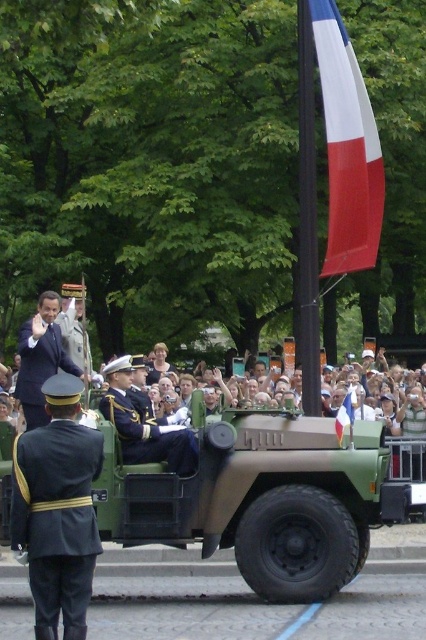
Between shiny blue fabric uniform at center and red fabric flag at center, which one has less height?

With less height is red fabric flag at center.

What do you see at coordinates (147, 435) in the screenshot? I see `shiny blue fabric uniform at center` at bounding box center [147, 435].

Is point (149, 435) behind point (342, 412)?

No.

The width and height of the screenshot is (426, 640). I want to click on shiny blue fabric uniform at center, so click(147, 435).

Does dark blue suit at center appear over red fabric flag at center?

Correct, dark blue suit at center is located above red fabric flag at center.

Which is in front, point (23, 360) or point (350, 400)?

Point (23, 360) is in front.

The width and height of the screenshot is (426, 640). Find the location of `dark blue suit at center`. dark blue suit at center is located at coordinates (40, 358).

Can you confirm if tricolor fabric flag at upper right is shorter than dark blue suit at center?

No, tricolor fabric flag at upper right is not shorter than dark blue suit at center.

Between point (327, 244) and point (25, 385), which one is positioned behind?

The point (327, 244) is more distant.

Does point (348, 202) come behind point (26, 332)?

Yes, it is behind point (26, 332).

Image resolution: width=426 pixels, height=640 pixels. Identify the location of tricolor fabric flag at upper right. (348, 147).